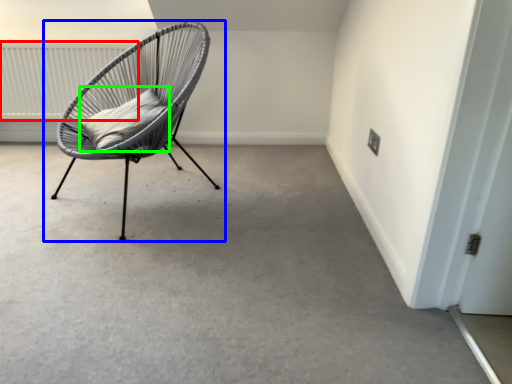
Question: Based on their relative distances, which object is nearer to radiator (highlighted by a red box)? Choose from chair (highlighted by a blue box) and pillow (highlighted by a green box).

Choices:
 (A) chair
 (B) pillow

Answer: (A)